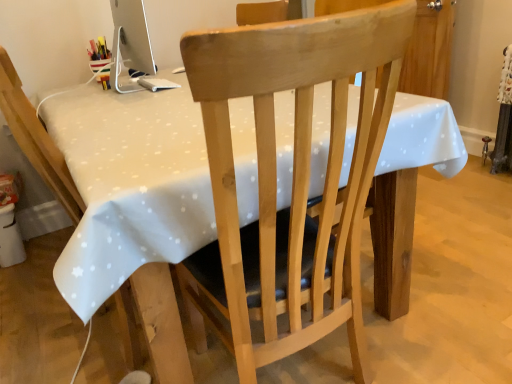
Question: Based on their positions, is natural wood chair at center, which is the 2th chair in left-to-right order, located to the left or right of white glossy computer monitor at upper left?

Choices:
 (A) left
 (B) right

Answer: (B)

Question: Based on their sizes in the image, would you say natural wood chair at center, the first chair from the right, is bigger or smaller than white glossy computer monitor at upper left?

Choices:
 (A) big
 (B) small

Answer: (A)

Question: Estimate the real-world distances between objects in this image. Which object is closer to the white dotted tablecloth at center?

Choices:
 (A) light wood chair at center, the 2th chair positioned from the right
 (B) natural wood chair at center, the first chair from the right
 (C) white glossy computer monitor at upper left

Answer: (B)

Question: Based on their relative distances, which object is nearer to the white dotted tablecloth at center?

Choices:
 (A) white glossy computer monitor at upper left
 (B) natural wood chair at center, the first chair from the right
 (C) light wood chair at center, which is the 1th chair from left to right

Answer: (B)